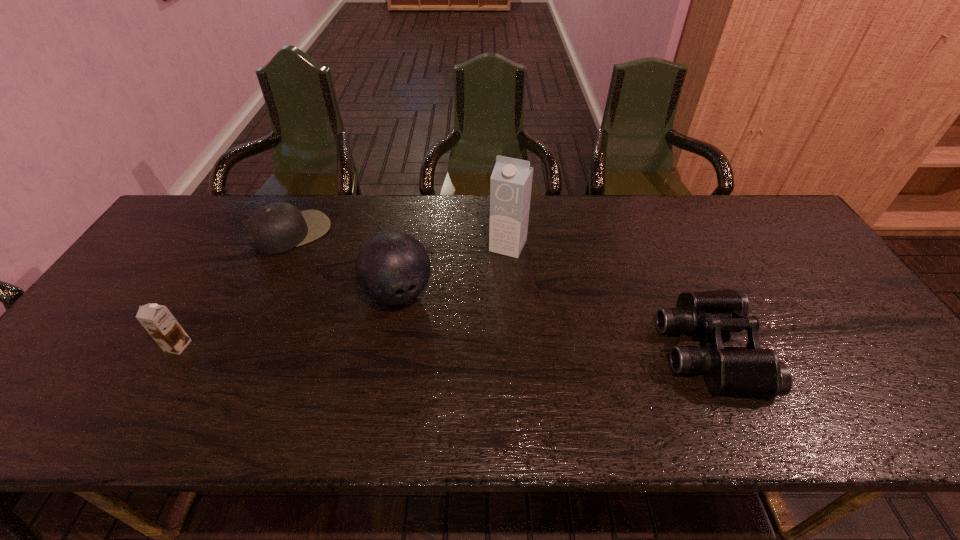
Identify the location of free point located on the grip area of the third object from left to right. (421, 336).

Locate an element on the screen. vacant space situated 0.090m on the grip area of the third object from left to right is located at coordinates (424, 342).

Find the location of a particular element. This screenshot has width=960, height=540. vacant space located 0.190m on the grip area of the third object from left to right is located at coordinates (442, 373).

The height and width of the screenshot is (540, 960). I want to click on vacant space located on the brim of the cap, so click(x=338, y=282).

Find the location of a particular element. The height and width of the screenshot is (540, 960). vacant space located on the brim of the cap is located at coordinates (363, 312).

Locate an element on the screen. Image resolution: width=960 pixels, height=540 pixels. free region located on the brim of the cap is located at coordinates (345, 290).

Image resolution: width=960 pixels, height=540 pixels. I want to click on free region located on the front label of the carton, so click(x=450, y=360).

The image size is (960, 540). I want to click on vacant area located 0.140m on the front label of the carton, so click(486, 291).

Where is `vacant space located on the front label of the carton`? The width and height of the screenshot is (960, 540). vacant space located on the front label of the carton is located at coordinates (483, 295).

Where is `cap present at the far edge`? The width and height of the screenshot is (960, 540). cap present at the far edge is located at coordinates (275, 228).